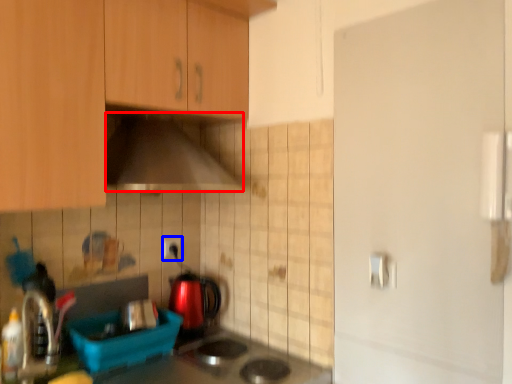
Question: Which of the following is the closest to the observer, home appliance (highlighted by a red box) or electric outlet (highlighted by a blue box)?

Choices:
 (A) home appliance
 (B) electric outlet

Answer: (A)